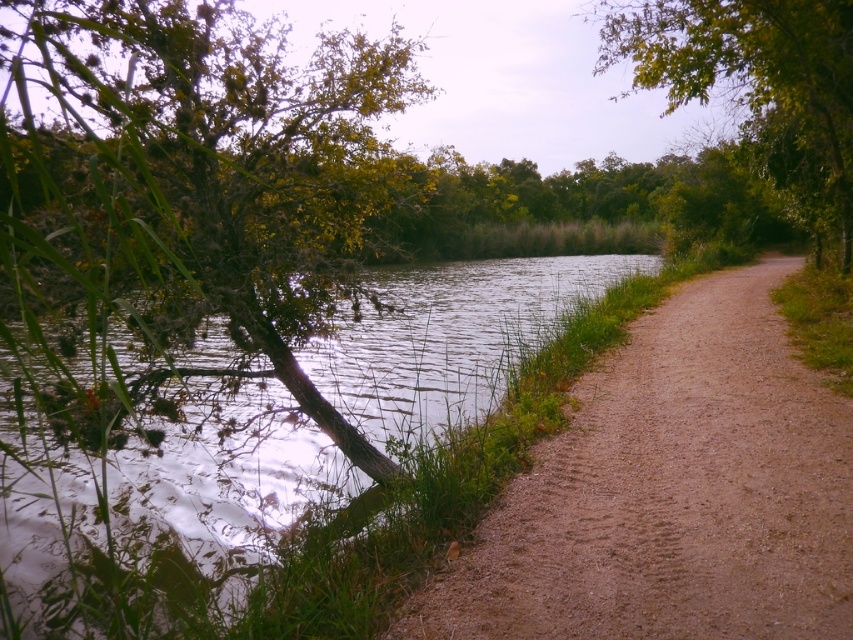
Question: Estimate the real-world distances between objects in this image. Which object is closer to the dirt/gravel path at center?

Choices:
 (A) green leafy tree at upper right
 (B) green grassy river at lower left

Answer: (B)

Question: Is the position of green leafy tree at left more distant than that of green grassy river at lower left?

Choices:
 (A) no
 (B) yes

Answer: (A)

Question: Can you confirm if dirt/gravel path at center is thinner than green leafy tree at upper right?

Choices:
 (A) no
 (B) yes

Answer: (B)

Question: Does green leafy tree at left appear over dirt/gravel path at center?

Choices:
 (A) yes
 (B) no

Answer: (A)

Question: Considering the real-world distances, which object is closest to the dirt/gravel path at center?

Choices:
 (A) green leafy tree at upper right
 (B) green leafy tree at left

Answer: (B)

Question: Which point is closer to the camera?

Choices:
 (A) click(x=299, y=284)
 (B) click(x=619, y=502)
 (C) click(x=849, y=58)
 (D) click(x=198, y=566)

Answer: (B)